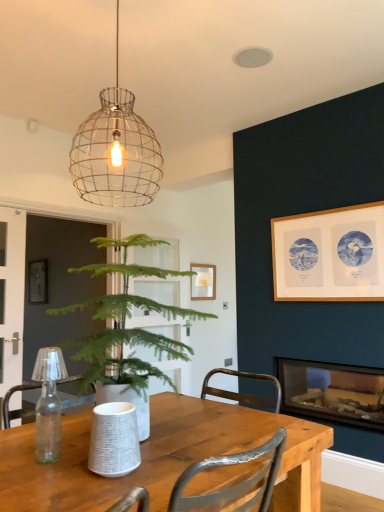
Question: Does wire mesh pendant light at upper center come in front of wooden picture frame at upper right?

Choices:
 (A) no
 (B) yes

Answer: (B)

Question: Is wire mesh pendant light at upper center wider than wooden picture frame at upper right?

Choices:
 (A) no
 (B) yes

Answer: (B)

Question: Does wire mesh pendant light at upper center have a lesser width compared to wooden picture frame at upper right?

Choices:
 (A) yes
 (B) no

Answer: (B)

Question: Considering the relative positions of wire mesh pendant light at upper center and wooden picture frame at upper right in the image provided, is wire mesh pendant light at upper center behind wooden picture frame at upper right?

Choices:
 (A) yes
 (B) no

Answer: (B)

Question: Is wire mesh pendant light at upper center smaller than wooden picture frame at upper right?

Choices:
 (A) no
 (B) yes

Answer: (A)

Question: Are wire mesh pendant light at upper center and wooden picture frame at upper right far apart?

Choices:
 (A) yes
 (B) no

Answer: (A)

Question: Considering the relative sizes of wooden table at center and green leafy plant at center in the image provided, is wooden table at center taller than green leafy plant at center?

Choices:
 (A) no
 (B) yes

Answer: (A)

Question: Can you confirm if wooden table at center is thinner than green leafy plant at center?

Choices:
 (A) no
 (B) yes

Answer: (B)

Question: Can you see wooden table at center touching green leafy plant at center?

Choices:
 (A) yes
 (B) no

Answer: (B)

Question: Is wooden table at center positioned beyond the bounds of green leafy plant at center?

Choices:
 (A) yes
 (B) no

Answer: (A)

Question: Is wooden table at center turned away from green leafy plant at center?

Choices:
 (A) yes
 (B) no

Answer: (B)

Question: Can you confirm if wooden table at center is wider than green leafy plant at center?

Choices:
 (A) no
 (B) yes

Answer: (A)

Question: From the image's perspective, is wire mesh pendant light at upper center under wooden table at center?

Choices:
 (A) no
 (B) yes

Answer: (A)